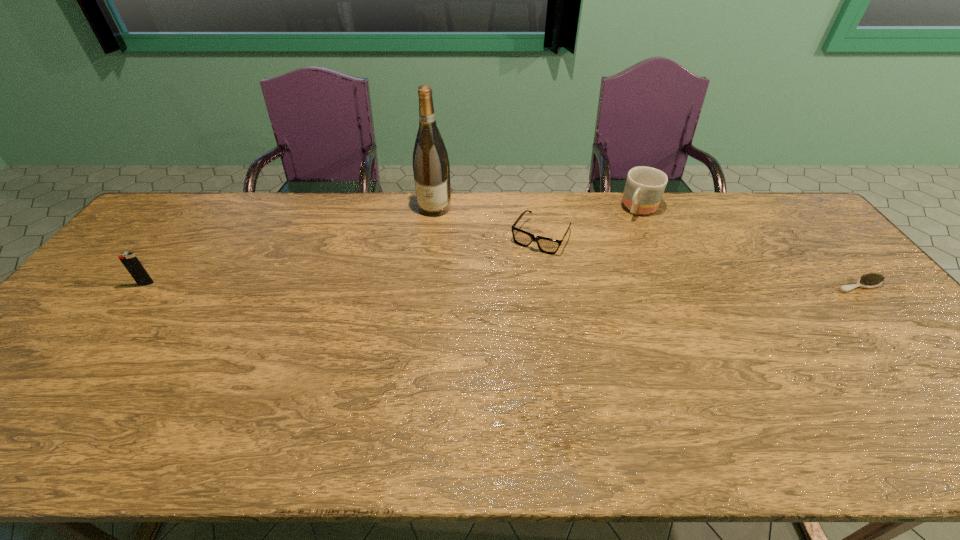
Where is `vacant space situated on the side with the handle of the mug`? vacant space situated on the side with the handle of the mug is located at coordinates (584, 289).

Find the location of `vacant region located on the side with the handle of the mug`. vacant region located on the side with the handle of the mug is located at coordinates (619, 241).

I want to click on free point located 0.190m on the side with the handle of the mug, so click(x=612, y=251).

This screenshot has height=540, width=960. I want to click on vacant area located on the label of the second object from left to right, so click(x=419, y=253).

Identify the location of vacant area situated 0.260m on the label of the second object from left to right. (413, 270).

You are a GUI agent. You are given a task and a screenshot of the screen. Output one action in this format:
    pyautogui.click(x=<x>, y=<y>)
    Task: Click on the vacant area situated 0.070m on the label of the second object from left to right
    
    Given the screenshot: What is the action you would take?
    pyautogui.click(x=426, y=231)

Identify the location of blank space located 0.380m on the front-facing side of the sunglasses. This screenshot has width=960, height=540. (473, 343).

The image size is (960, 540). What are the coordinates of `vacant region located on the front-facing side of the sunglasses` in the screenshot? It's located at (482, 329).

This screenshot has width=960, height=540. I want to click on vacant space located on the front-facing side of the sunglasses, so click(x=516, y=274).

Find the location of a particular element. mug present at the far edge is located at coordinates (644, 187).